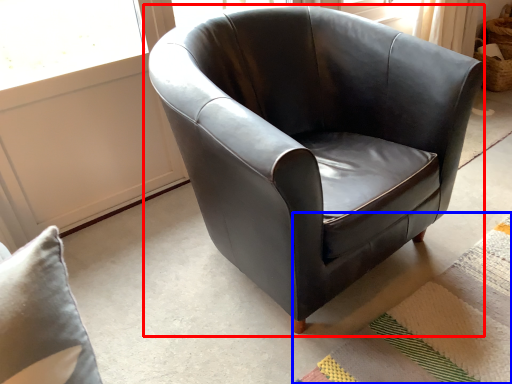
Question: Which of the following is the closest to the observer, chair (highlighted by a red box) or mat (highlighted by a blue box)?

Choices:
 (A) chair
 (B) mat

Answer: (A)